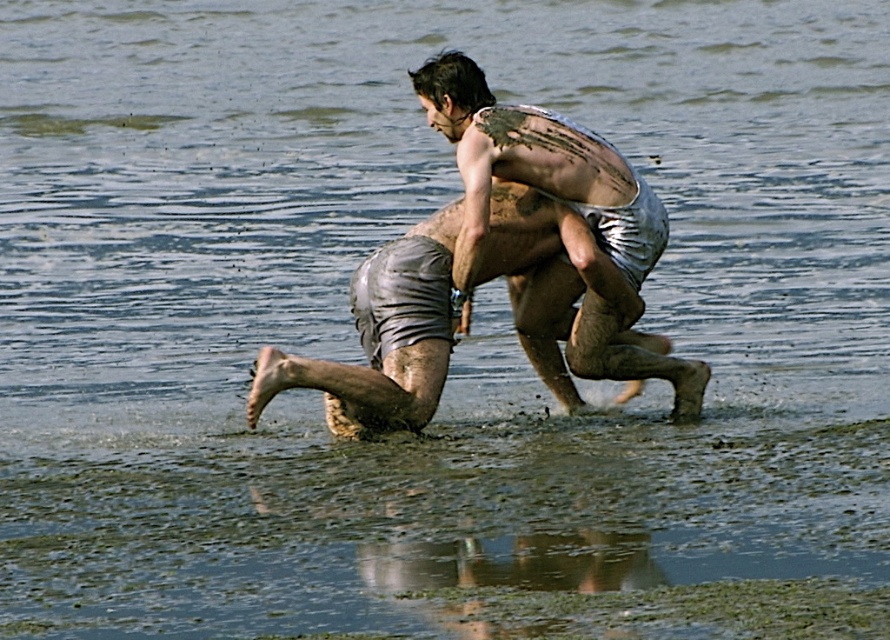
You are a photographer trying to capture the scene from the shore. You notice the muddy wet ground at lower center and the muddy skin torso at center. Which object is located to the left of the other?

The muddy wet ground at lower center is positioned on the left side of muddy skin torso at center.

You are standing at the edge of the water and want to reach the point marked with point (101, 509) and point (552, 131). Which point should you walk towards first to get to both points in the shortest path possible?

You should walk towards point (101, 509) first since it is closer to you than point (552, 131). After reaching point (101, 509), you can then proceed to point (552, 131).

You are standing at the edge of the water and want to reach the point marked at coordinates point (511, 563). If your maximum walking distance is 6 meters, can you reach it without swimming?

The distance of point (511, 563) from viewer is 7.06 meters, which is beyond your 6 meter limit. You would need to swim to reach it.